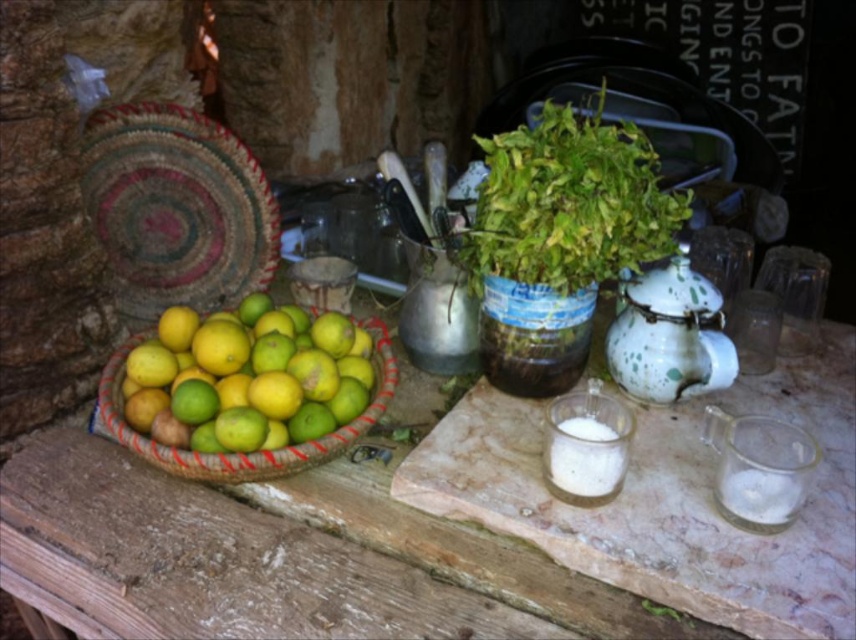
Question: Which is farther from the green leafy plant at upper center?

Choices:
 (A) speckled ceramic teapot at center-right
 (B) bright yellow-green woven basket at left

Answer: (B)

Question: Which object is farther from the camera taking this photo?

Choices:
 (A) speckled ceramic teapot at center-right
 (B) bright yellow-green woven basket at left
 (C) green leafy plant at upper center

Answer: (A)

Question: Which of the following is the closest to the observer?

Choices:
 (A) (128, 348)
 (B) (525, 240)
 (C) (666, 273)

Answer: (B)

Question: Where is speckled ceramic teapot at center-right located in relation to bright yellow-green woven basket at left in the image?

Choices:
 (A) below
 (B) above

Answer: (B)

Question: Does green leafy plant at upper center have a larger size compared to speckled ceramic teapot at center-right?

Choices:
 (A) yes
 (B) no

Answer: (A)

Question: Does green leafy plant at upper center come behind bright yellow-green woven basket at left?

Choices:
 (A) no
 (B) yes

Answer: (B)